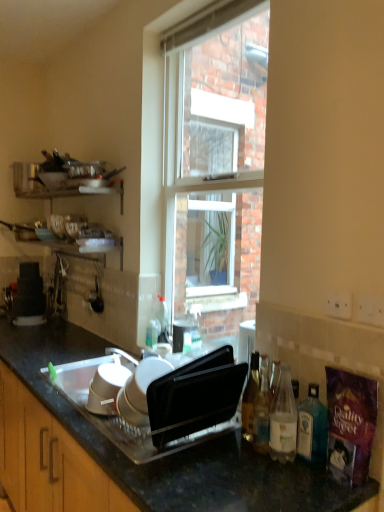
Question: Considering the relative positions of translucent glass bottle at lower right, acting as the third bottle starting from the left, and translucent glass bottle at right, which ranks as the 1th bottle in right-to-left order, in the image provided, is translucent glass bottle at lower right, acting as the third bottle starting from the left, to the left of translucent glass bottle at right, which ranks as the 1th bottle in right-to-left order, from the viewer's perspective?

Choices:
 (A) yes
 (B) no

Answer: (A)

Question: From a real-world perspective, is translucent glass bottle at lower right, positioned as the 2th bottle in right-to-left order, positioned under translucent glass bottle at right, which ranks as the 1th bottle in right-to-left order, based on gravity?

Choices:
 (A) no
 (B) yes

Answer: (A)

Question: Is translucent glass bottle at lower right, acting as the third bottle starting from the left, positioned beyond the bounds of translucent glass bottle at right, which ranks as the 1th bottle in right-to-left order?

Choices:
 (A) no
 (B) yes

Answer: (B)

Question: Is translucent glass bottle at lower right, positioned as the 2th bottle in right-to-left order, to the right of translucent glass bottle at right, the 4th bottle positioned from the left, from the viewer's perspective?

Choices:
 (A) no
 (B) yes

Answer: (A)

Question: Is translucent glass bottle at lower right, acting as the third bottle starting from the left, closer to the viewer compared to translucent glass bottle at right, the 4th bottle positioned from the left?

Choices:
 (A) yes
 (B) no

Answer: (A)

Question: Is translucent glass bottle at lower right, acting as the third bottle starting from the left, touching translucent glass bottle at right, the 4th bottle positioned from the left?

Choices:
 (A) no
 (B) yes

Answer: (B)

Question: From a real-world perspective, is translucent glass bottle at right, marked as the first bottle in a left-to-right arrangement, located beneath black granite countertop at center?

Choices:
 (A) yes
 (B) no

Answer: (B)

Question: Is translucent glass bottle at right, positioned as the fourth bottle in right-to-left order, facing towards black granite countertop at center?

Choices:
 (A) yes
 (B) no

Answer: (B)

Question: Can you confirm if translucent glass bottle at right, marked as the first bottle in a left-to-right arrangement, is smaller than black granite countertop at center?

Choices:
 (A) no
 (B) yes

Answer: (B)

Question: Is translucent glass bottle at right, marked as the first bottle in a left-to-right arrangement, with black granite countertop at center?

Choices:
 (A) yes
 (B) no

Answer: (B)

Question: Is the depth of translucent glass bottle at right, marked as the first bottle in a left-to-right arrangement, greater than that of black granite countertop at center?

Choices:
 (A) no
 (B) yes

Answer: (B)

Question: Does translucent glass bottle at right, positioned as the fourth bottle in right-to-left order, appear on the left side of black granite countertop at center?

Choices:
 (A) yes
 (B) no

Answer: (B)

Question: Considering the relative sizes of translucent glass bottle at lower right, acting as the third bottle starting from the left, and translucent glass bottle at lower right, which is counted as the 3th bottle, starting from the right, in the image provided, is translucent glass bottle at lower right, acting as the third bottle starting from the left, shorter than translucent glass bottle at lower right, which is counted as the 3th bottle, starting from the right,?

Choices:
 (A) yes
 (B) no

Answer: (B)